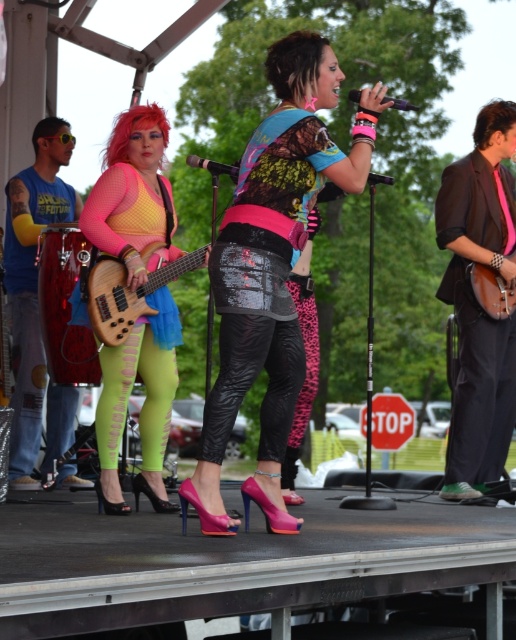
Question: Is brushed metal drum at left further to camera compared to wooden bass guitar at center?

Choices:
 (A) no
 (B) yes

Answer: (B)

Question: Which point is closer to the camera taking this photo?

Choices:
 (A) (166, 429)
 (B) (311, 202)
 (C) (498, 275)

Answer: (B)

Question: Among these points, which one is farthest from the camera?

Choices:
 (A) (481, 410)
 (B) (295, 326)
 (C) (153, 314)

Answer: (A)

Question: Is shiny sequined skirt at center wider than brushed metal drum at left?

Choices:
 (A) yes
 (B) no

Answer: (A)

Question: Is shiny brown guitar at right to the left of wooden acoustic guitar at right from the viewer's perspective?

Choices:
 (A) yes
 (B) no

Answer: (A)

Question: Which of the following is the farthest from the observer?

Choices:
 (A) shiny sequined skirt at center
 (B) neon green mesh top at center
 (C) shiny brown guitar at right

Answer: (C)